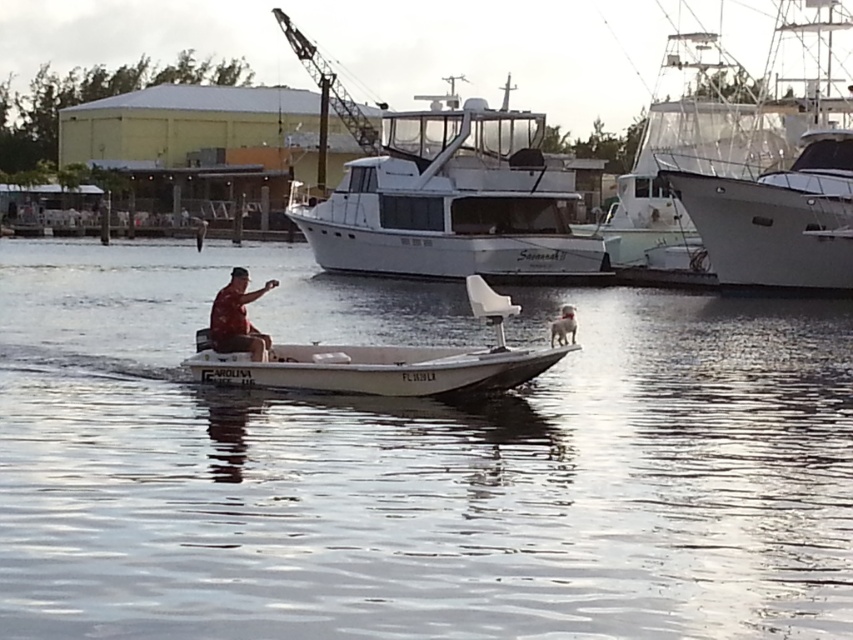
Is white glossy boat at center above white glossy boat at upper right?

Actually, white glossy boat at center is below white glossy boat at upper right.

Can you confirm if white glossy boat at center is smaller than white glossy boat at upper right?

Indeed, white glossy boat at center has a smaller size compared to white glossy boat at upper right.

Which is in front, point (549, 241) or point (799, 243)?

Point (799, 243) is in front.

The width and height of the screenshot is (853, 640). I want to click on white glossy boat at center, so click(451, 202).

Does clear water at center have a lesser width compared to white glossy boat at upper right?

Indeed, clear water at center has a lesser width compared to white glossy boat at upper right.

Is clear water at center positioned in front of white glossy boat at upper right?

Yes, clear water at center is closer to the viewer.

Between point (154, 612) and point (840, 285), which one is positioned behind?

The point (840, 285) is more distant.

The image size is (853, 640). In order to click on clear water at center in this screenshot , I will do pos(415,464).

Can you confirm if white matte boat at center is positioned below metallic gray crane at upper center?

Indeed, white matte boat at center is positioned under metallic gray crane at upper center.

Image resolution: width=853 pixels, height=640 pixels. Identify the location of white matte boat at center. (370, 356).